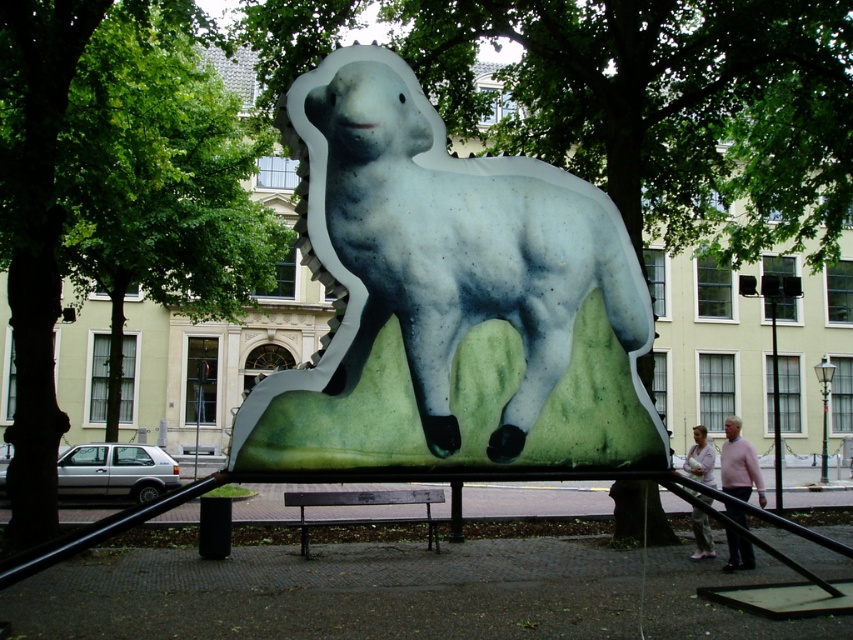
Question: Which point is farther from the camera taking this photo?

Choices:
 (A) (434, 372)
 (B) (61, 264)

Answer: (B)

Question: Which object appears closest to the camera in this image?

Choices:
 (A) matte white lamb at center
 (B) green leafy tree at center

Answer: (A)

Question: Is matte white lamb at center positioned at the back of green leafy tree at center?

Choices:
 (A) yes
 (B) no

Answer: (B)

Question: Does matte white lamb at center have a larger size compared to green leafy tree at center?

Choices:
 (A) no
 (B) yes

Answer: (A)

Question: Is matte white lamb at center positioned in front of green leafy tree at center?

Choices:
 (A) no
 (B) yes

Answer: (B)